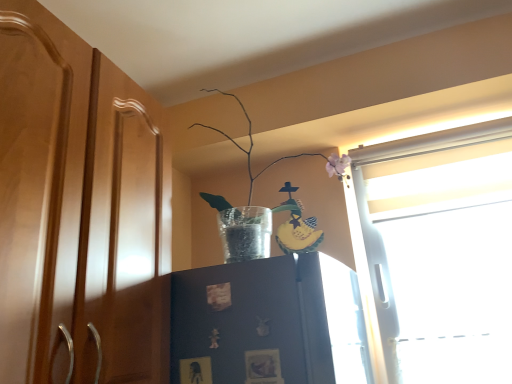
Question: From the image's perspective, relative to matte wood dresser at center, is matte dark blue cabinet at center above or below?

Choices:
 (A) above
 (B) below

Answer: (B)

Question: Is point (215, 380) closer or farther from the camera than point (33, 102)?

Choices:
 (A) farther
 (B) closer

Answer: (A)

Question: Which of these objects is positioned closest to the matte wood dresser at center?

Choices:
 (A) matte dark blue cabinet at center
 (B) clear glass vase at upper center

Answer: (A)

Question: Based on their relative distances, which object is nearer to the matte dark blue cabinet at center?

Choices:
 (A) matte wood dresser at center
 (B) clear glass vase at upper center

Answer: (A)